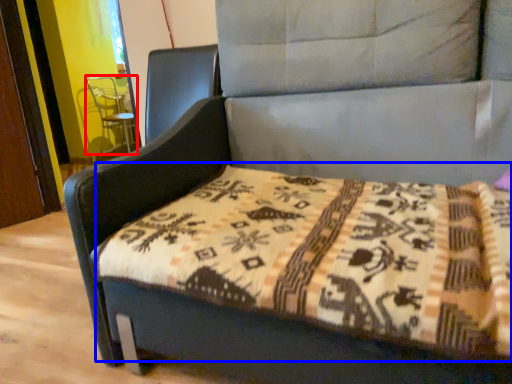
Question: Among these objects, which one is nearest to the camera, swivel chair (highlighted by a red box) or mattress (highlighted by a blue box)?

Choices:
 (A) swivel chair
 (B) mattress

Answer: (B)